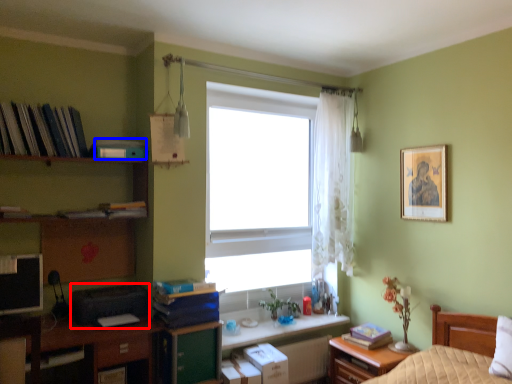
Question: Which point is closer to the camera, printer (highlighted by a red box) or book (highlighted by a blue box)?

Choices:
 (A) printer
 (B) book

Answer: (A)